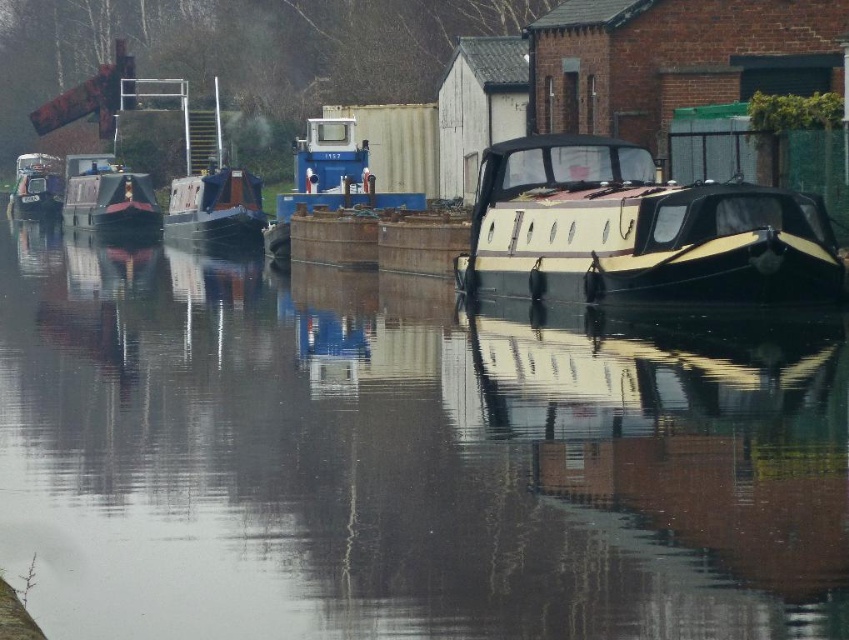
Looking at this image, which of these two, matte black barge at center or matte black boat at left, stands shorter?

With less height is matte black barge at center.

Who is more forward, (233, 240) or (37, 180)?

Point (233, 240) is more forward.

Does point (266, 218) lie in front of point (60, 198)?

That is True.

At what (x,y) coordinates should I click in order to perform the action: click on matte black barge at center. Please return your answer as a coordinate pair (x, y). The width and height of the screenshot is (849, 640). Looking at the image, I should click on (216, 209).

Does black polished wood boat at center have a greater width compared to shiny black boat at left?

Incorrect, black polished wood boat at center's width does not surpass shiny black boat at left's.

Does point (561, 147) lie in front of point (77, 216)?

Yes, point (561, 147) is closer to viewer.

The image size is (849, 640). I want to click on black polished wood boat at center, so click(x=637, y=230).

Does point (412, 525) lie in front of point (499, 228)?

Yes, it is in front of point (499, 228).

Is glossy water at center wider than black polished wood boat at center?

Indeed, glossy water at center has a greater width compared to black polished wood boat at center.

Which is behind, point (10, 496) or point (717, 241)?

Positioned behind is point (717, 241).

You are a GUI agent. You are given a task and a screenshot of the screen. Output one action in this format:
    pyautogui.click(x=<x>, y=<y>)
    Task: Click on the glossy water at center
    The image size is (849, 640).
    Given the screenshot: What is the action you would take?
    pyautogui.click(x=398, y=461)